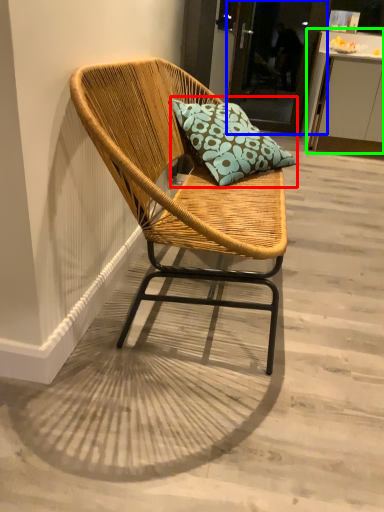
Question: Which is farther away from pillow (highlighted by a red box)? glass door (highlighted by a blue box) or table (highlighted by a green box)?

Choices:
 (A) glass door
 (B) table

Answer: (A)